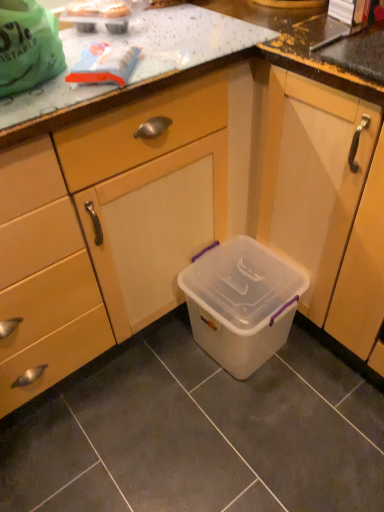
Question: Can you confirm if transparent plastic storage box at center is taller than transparent plastic container at lower center?

Choices:
 (A) no
 (B) yes

Answer: (A)

Question: From a real-world perspective, is transparent plastic storage box at center located beneath transparent plastic container at lower center?

Choices:
 (A) no
 (B) yes

Answer: (B)

Question: From a real-world perspective, does transparent plastic storage box at center stand above transparent plastic container at lower center?

Choices:
 (A) no
 (B) yes

Answer: (A)

Question: Does transparent plastic storage box at center have a lesser width compared to transparent plastic container at lower center?

Choices:
 (A) yes
 (B) no

Answer: (A)

Question: Is transparent plastic storage box at center wider than transparent plastic container at lower center?

Choices:
 (A) no
 (B) yes

Answer: (A)

Question: Is transparent plastic storage box at center behind transparent plastic container at lower center?

Choices:
 (A) yes
 (B) no

Answer: (A)

Question: Would you say transparent plastic container at lower center contains transparent plastic storage box at center?

Choices:
 (A) yes
 (B) no

Answer: (B)

Question: From the image's perspective, is transparent plastic container at lower center below transparent plastic storage box at center?

Choices:
 (A) yes
 (B) no

Answer: (B)

Question: From a real-world perspective, is transparent plastic container at lower center beneath transparent plastic storage box at center?

Choices:
 (A) yes
 (B) no

Answer: (B)

Question: Are transparent plastic container at lower center and transparent plastic storage box at center beside each other?

Choices:
 (A) yes
 (B) no

Answer: (B)

Question: Considering the relative sizes of transparent plastic container at lower center and transparent plastic storage box at center in the image provided, is transparent plastic container at lower center wider than transparent plastic storage box at center?

Choices:
 (A) no
 (B) yes

Answer: (B)

Question: Can you confirm if transparent plastic container at lower center is smaller than transparent plastic storage box at center?

Choices:
 (A) yes
 (B) no

Answer: (B)

Question: Is transparent plastic container at lower center inside the boundaries of transparent plastic storage box at center, or outside?

Choices:
 (A) inside
 (B) outside

Answer: (B)